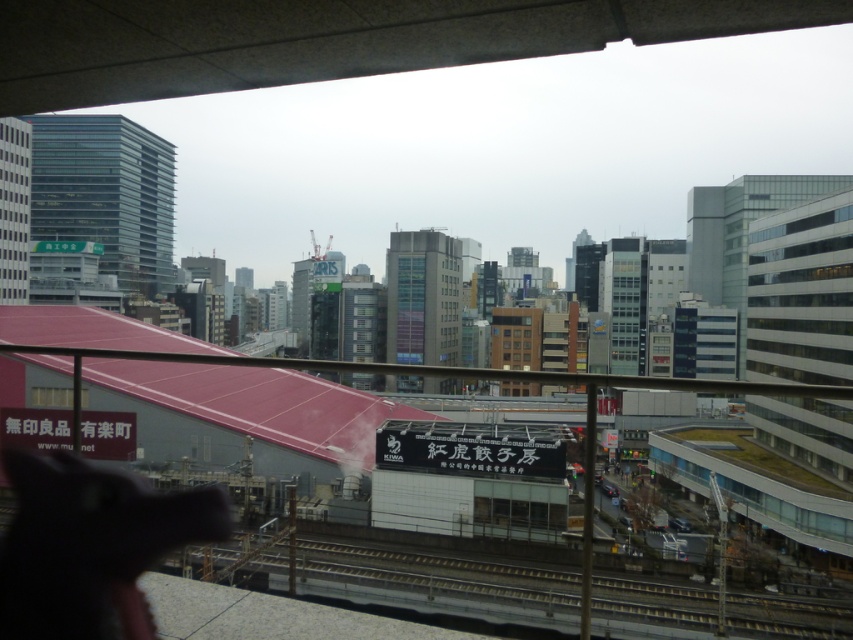
You are standing on the concrete overpass at upper center and want to walk to the metallic gray train track at lower center. Which direction should you move to reach the track?

You should move to your right because the concrete overpass at upper center is to the left of the metallic gray train track at lower center.

You are standing at the point labeled point (328, 38) in the image. Looking around, you see the concrete overpass at upper center. What is the name of the structure you are currently standing on?

The point (328, 38) corresponds to the concrete overpass at upper center, so you are standing on the concrete overpass at upper center.

You are a city planner analyzing the urban layout. You need to determine if the concrete overpass at upper center can accommodate a new pedestrian walkway that requires a structure twice its current size. Based on the scene, can the space where the metallic gray train track at lower center is located provide enough room for the expanded overpass?

The concrete overpass at upper center is smaller in size than the metallic gray train track at lower center. Since the train track area is larger, it might have sufficient space to accommodate the expanded overpass, but further measurements would be needed to confirm.